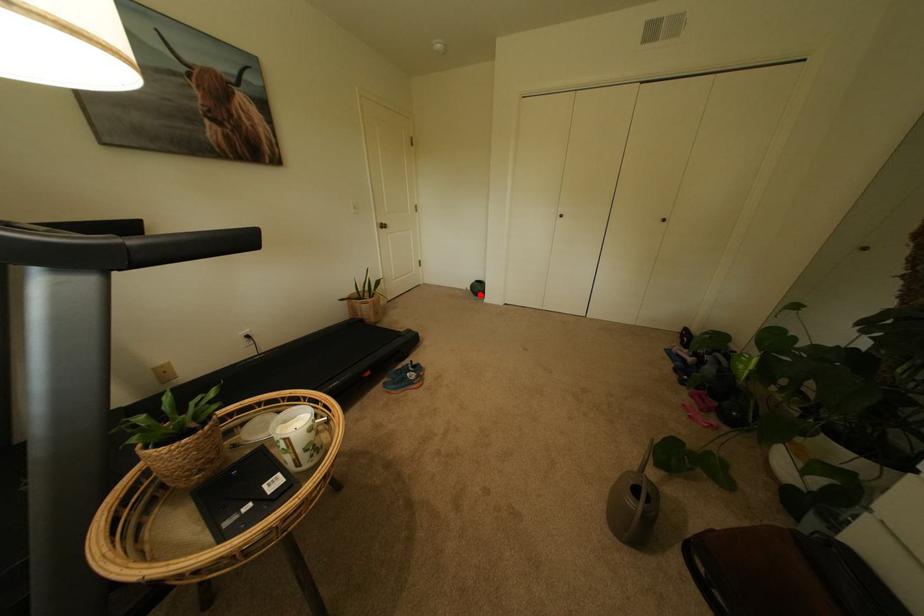
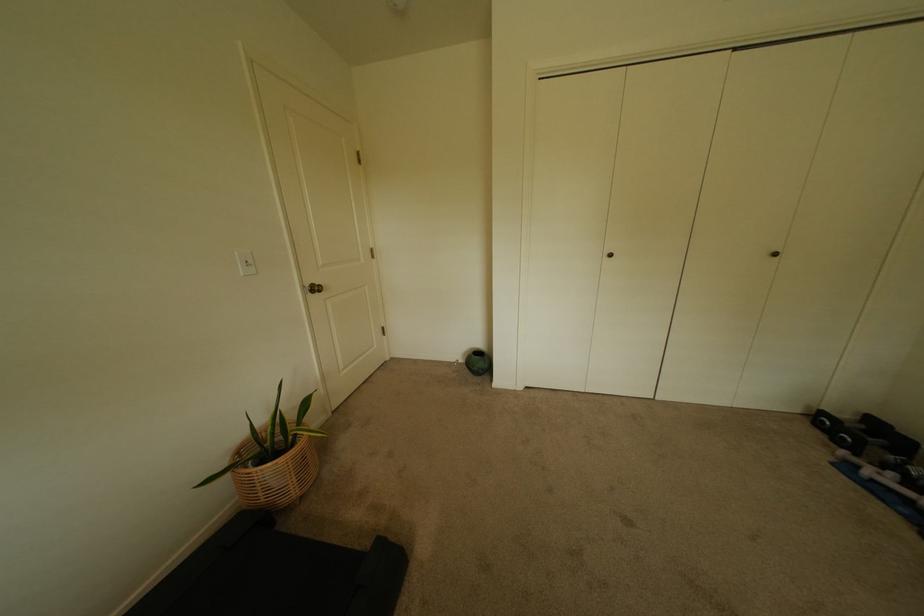
Where in the second image is the point corresponding to the highlighted location from the first image?

(476, 371)